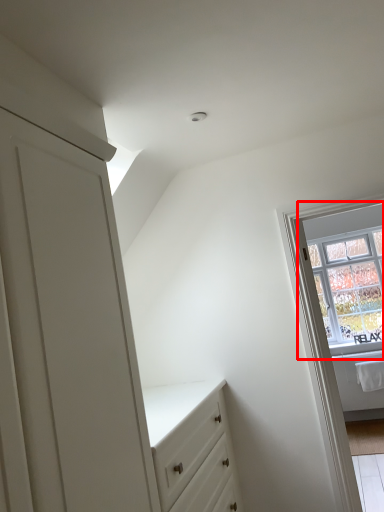
Question: Considering the relative positions of window (annotated by the red box) and window frame in the image provided, where is window (annotated by the red box) located with respect to the staircase?

Choices:
 (A) left
 (B) right

Answer: (B)